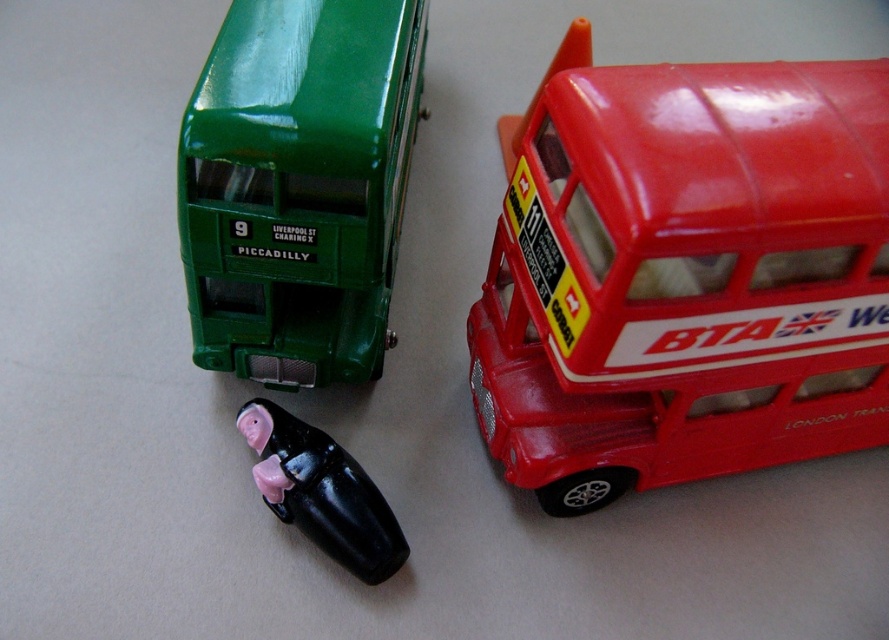
You are a child playing with the green glossy bus at upper left and the black glossy piglet at center. You want to place both toys on a small shelf that can only hold the smaller one. Which toy should you choose to keep on the shelf?

The black glossy piglet at center is smaller, so you should keep it on the shelf since it can fit better.

You are setting up a display for a toy store. You have a shiny plastic bus at upper right and a black glossy piglet at center. Where should you place a new decorative tree so that it is between them?

The decorative tree should be placed between the shiny plastic bus at upper right and the black glossy piglet at center, positioned below the bus and above the piglet since the bus is above the piglet.

You are a child trying to fit both the shiny plastic bus at upper right and the green glossy bus at upper left into a rectangular box. The box can only accommodate the narrower of the two buses. Which bus should you choose to fit into the box?

The green glossy bus at upper left is narrower than the shiny plastic bus at upper right, so you should choose the green glossy bus at upper left to fit into the box.